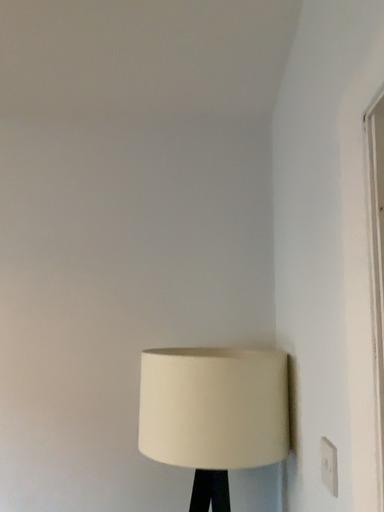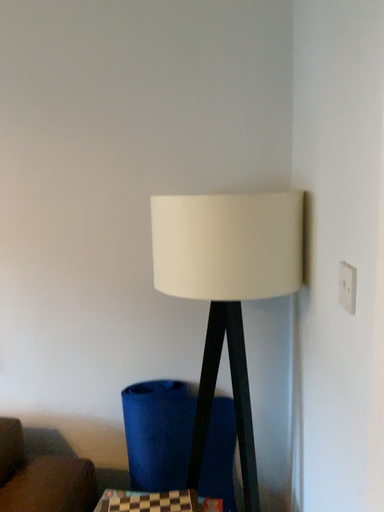
Question: Which way did the camera rotate in the video?

Choices:
 (A) rotated upward
 (B) rotated downward

Answer: (B)